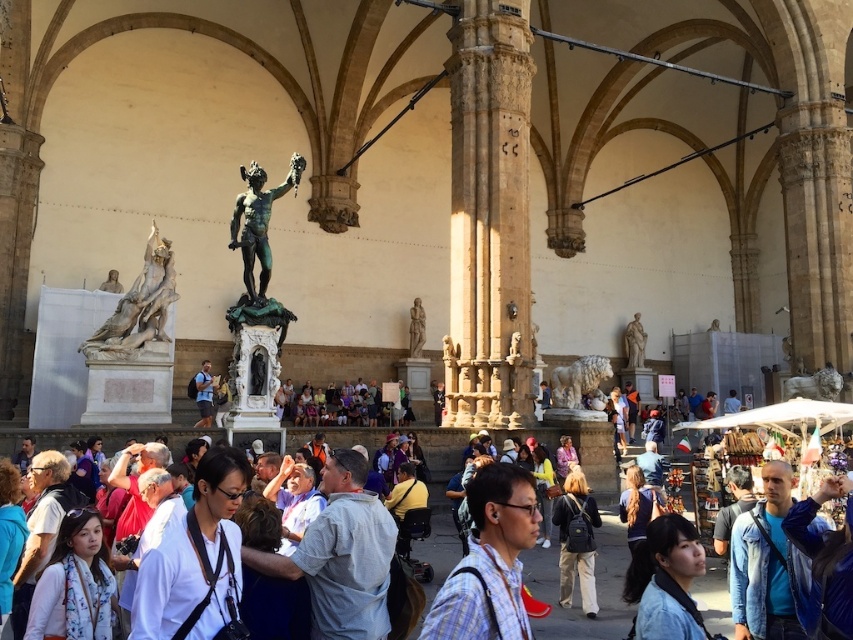
Who is lower down, plaid shirt at center or polished marble statue at center?

plaid shirt at center

Is plaid shirt at center shorter than polished marble statue at center?

Incorrect, plaid shirt at center's height does not fall short of polished marble statue at center's.

The width and height of the screenshot is (853, 640). I want to click on plaid shirt at center, so click(489, 561).

The height and width of the screenshot is (640, 853). In order to click on plaid shirt at center in this screenshot , I will do `click(489, 561)`.

Who is shorter, blue denim jacket at lower right or matte black backpack at center?

blue denim jacket at lower right

Is blue denim jacket at lower right closer to camera compared to matte black backpack at center?

Yes, blue denim jacket at lower right is closer to the viewer.

This screenshot has height=640, width=853. In order to click on blue denim jacket at lower right in this screenshot , I will do `click(668, 572)`.

Which of these two, plaid shirt at center or white marble lion at center, stands taller?

Standing taller between the two is plaid shirt at center.

Which is below, plaid shirt at center or white marble lion at center?

plaid shirt at center

Is point (439, 600) positioned behind point (605, 372)?

No, (439, 600) is in front of (605, 372).

Find the location of a particular element. The height and width of the screenshot is (640, 853). plaid shirt at center is located at coordinates (489, 561).